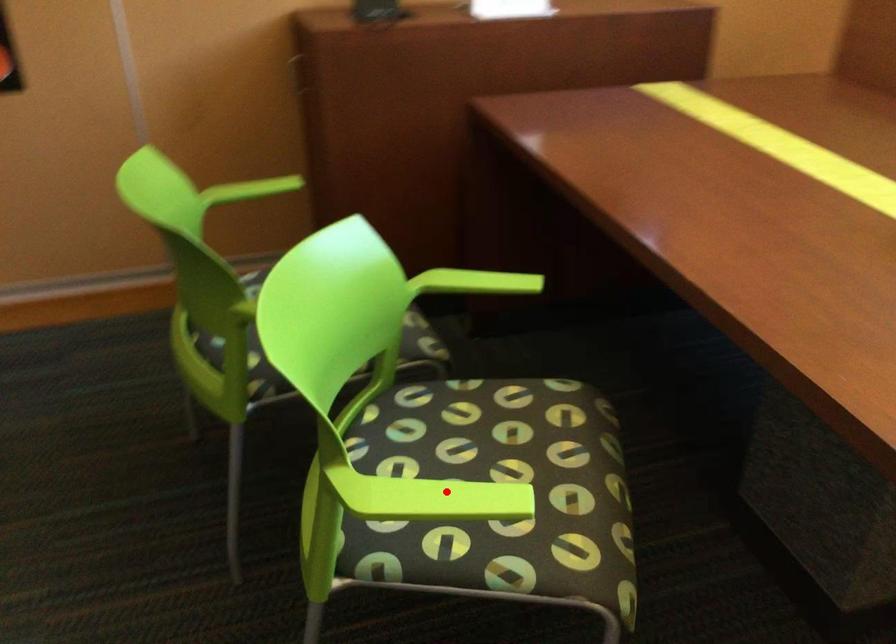
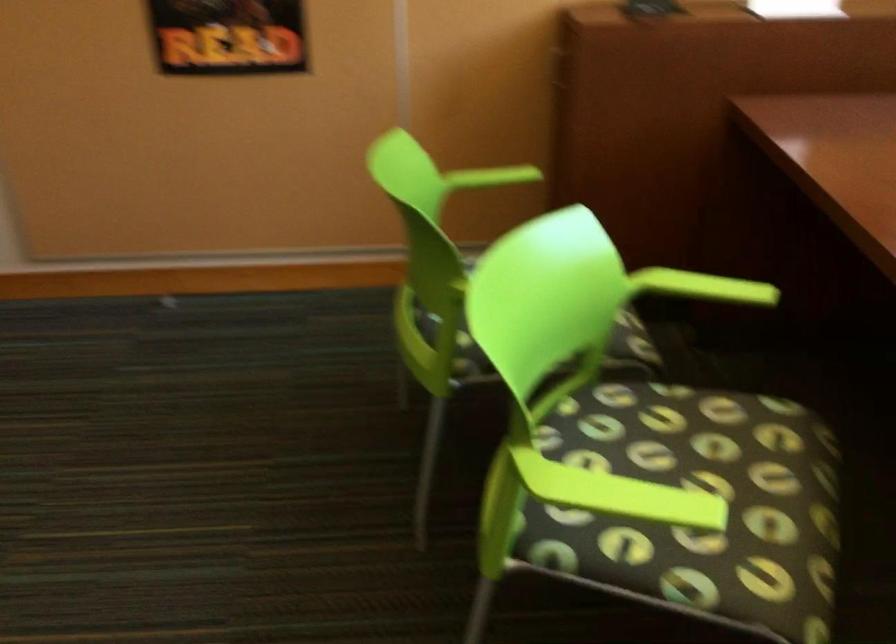
Where in the second image is the point corresponding to the highlighted location from the first image?

(619, 494)